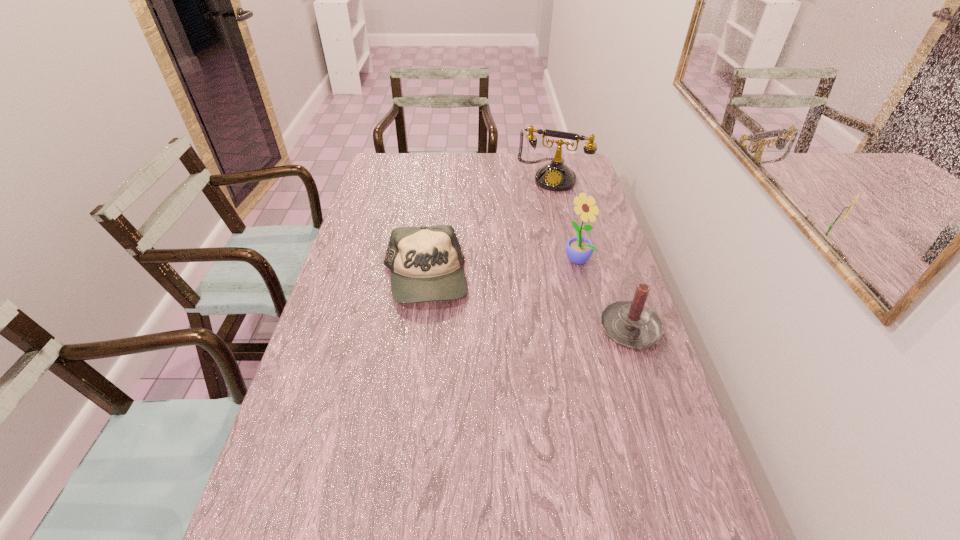
Where is `vacant space at the far edge of the desktop`? Image resolution: width=960 pixels, height=540 pixels. vacant space at the far edge of the desktop is located at coordinates (511, 161).

The height and width of the screenshot is (540, 960). Identify the location of vacant region at the near edge of the desktop. (348, 536).

In the image, there is a desktop. Identify the location of vacant space at the left edge. Image resolution: width=960 pixels, height=540 pixels. (359, 227).

Locate an element on the screen. This screenshot has width=960, height=540. free point at the right edge is located at coordinates (606, 287).

Find the location of a particular element. vacant region at the far left corner is located at coordinates [x=403, y=165].

The width and height of the screenshot is (960, 540). Identify the location of vacant region at the near left corner of the desktop. (253, 519).

The width and height of the screenshot is (960, 540). In order to click on free space between the baseball cap and the candle in this screenshot , I will do `click(528, 306)`.

Identify the location of vacant area that lies between the farthest object and the sunflower. [x=564, y=218].

You are a GUI agent. You are given a task and a screenshot of the screen. Output one action in this format:
    pyautogui.click(x=<x>, y=<y>)
    Task: Click on the free space that is in between the farthest object and the baseball cap
    The width and height of the screenshot is (960, 540).
    Given the screenshot: What is the action you would take?
    pyautogui.click(x=489, y=229)

You are a GUI agent. You are given a task and a screenshot of the screen. Output one action in this format:
    pyautogui.click(x=<x>, y=<y>)
    Task: Click on the free area in between the shortest object and the sunflower
    This screenshot has height=540, width=960.
    Given the screenshot: What is the action you would take?
    pyautogui.click(x=501, y=269)